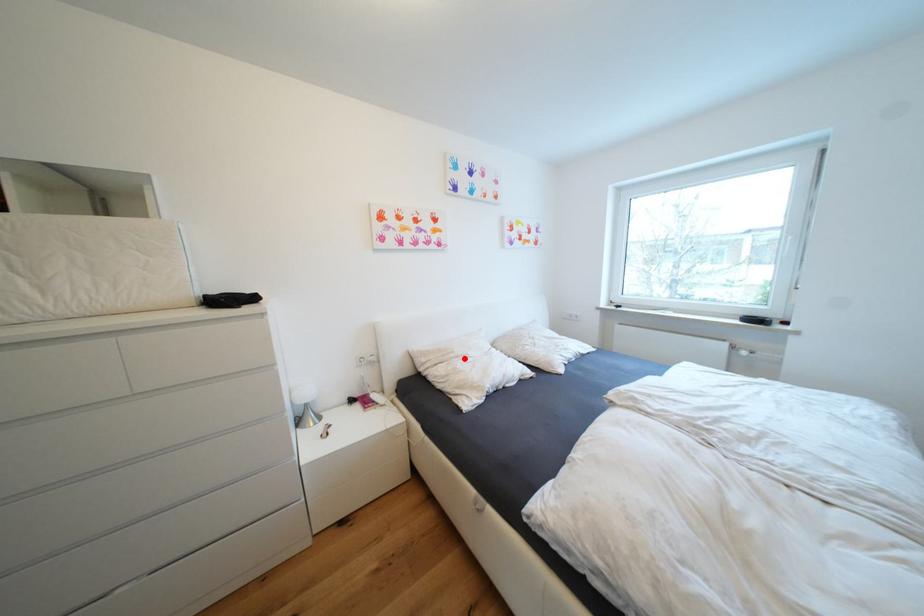
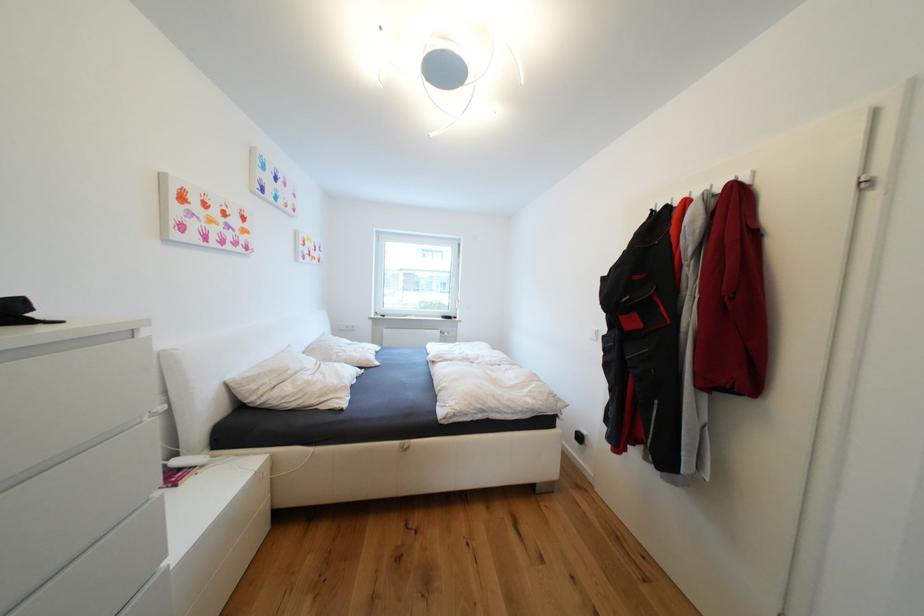
Question: I am providing you with two images of the same scene from different viewpoints. A red point is shown in image1. For the corresponding object point in image2, is it positioned nearer or farther from the camera?

Choices:
 (A) Nearer
 (B) Farther

Answer: (A)